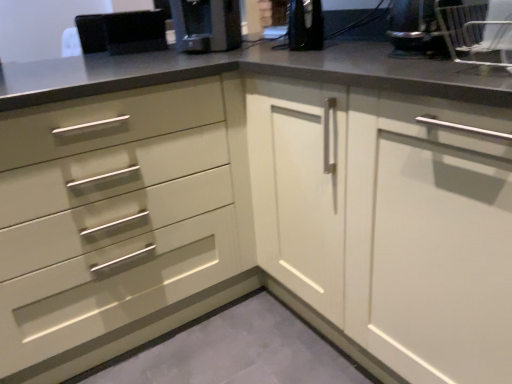
Question: Is black plastic bowl at upper right to the right of matte white cabinet at right from the viewer's perspective?

Choices:
 (A) yes
 (B) no

Answer: (B)

Question: From a real-world perspective, is black plastic bowl at upper right positioned over matte white cabinet at right based on gravity?

Choices:
 (A) yes
 (B) no

Answer: (A)

Question: Could you tell me if black plastic bowl at upper right is turned towards matte white cabinet at right?

Choices:
 (A) no
 (B) yes

Answer: (A)

Question: Does black plastic bowl at upper right touch matte white cabinet at right?

Choices:
 (A) yes
 (B) no

Answer: (B)

Question: From the image's perspective, does black plastic bowl at upper right appear higher than matte white cabinet at right?

Choices:
 (A) yes
 (B) no

Answer: (A)

Question: Considering the relative positions of black plastic bowl at upper right and matte white cabinet at right in the image provided, is black plastic bowl at upper right to the left of matte white cabinet at right from the viewer's perspective?

Choices:
 (A) yes
 (B) no

Answer: (A)

Question: From the image's perspective, would you say black plastic bowl at upper right is positioned over satin black coffee machine at upper center?

Choices:
 (A) yes
 (B) no

Answer: (B)

Question: Is black plastic bowl at upper right far from satin black coffee machine at upper center?

Choices:
 (A) yes
 (B) no

Answer: (B)

Question: Can you confirm if black plastic bowl at upper right is positioned to the left of satin black coffee machine at upper center?

Choices:
 (A) yes
 (B) no

Answer: (B)

Question: From a real-world perspective, is black plastic bowl at upper right located higher than satin black coffee machine at upper center?

Choices:
 (A) no
 (B) yes

Answer: (A)

Question: From the image's perspective, would you say black plastic bowl at upper right is shown under satin black coffee machine at upper center?

Choices:
 (A) yes
 (B) no

Answer: (A)

Question: Considering the relative sizes of black plastic bowl at upper right and satin black coffee machine at upper center in the image provided, is black plastic bowl at upper right thinner than satin black coffee machine at upper center?

Choices:
 (A) no
 (B) yes

Answer: (B)

Question: Does matte white cabinet at right have a smaller size compared to satin black coffee machine at upper center?

Choices:
 (A) yes
 (B) no

Answer: (B)